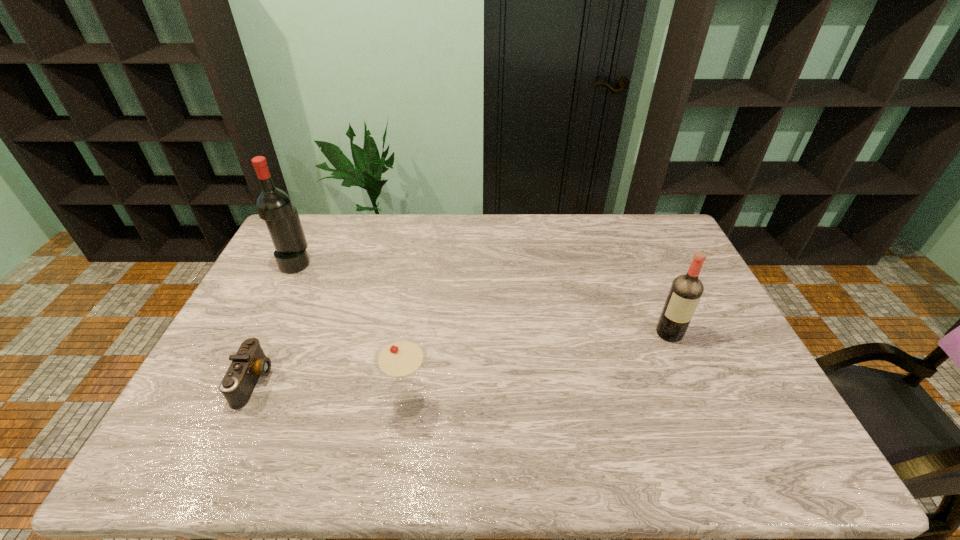
Where is `free region located 0.270m on the lens of the shortest object`? This screenshot has height=540, width=960. free region located 0.270m on the lens of the shortest object is located at coordinates (372, 381).

Find the location of `wine bottle that is at the left edge`. wine bottle that is at the left edge is located at coordinates (273, 205).

Find the location of a particular element. The height and width of the screenshot is (540, 960). camera positioned at the left edge is located at coordinates (250, 362).

Locate an element on the screen. The image size is (960, 540). object located at the right edge is located at coordinates pyautogui.click(x=686, y=290).

What are the coordinates of `vacant space at the far edge of the desktop` in the screenshot? It's located at (340, 226).

The height and width of the screenshot is (540, 960). In order to click on vacant space at the near edge in this screenshot , I will do `click(609, 465)`.

At what (x,y) coordinates should I click in order to perform the action: click on vacant position at the left edge of the desktop. Please return your answer as a coordinate pair (x, y). This screenshot has width=960, height=540. Looking at the image, I should click on (281, 295).

Where is `free region at the right edge of the desktop`? free region at the right edge of the desktop is located at coordinates (714, 325).

Where is `free space at the far left corner`? The height and width of the screenshot is (540, 960). free space at the far left corner is located at coordinates (305, 217).

At what (x,y) coordinates should I click in order to perform the action: click on vacant space at the near left corner of the desktop. Please return your answer as a coordinate pair (x, y). Looking at the image, I should click on (216, 442).